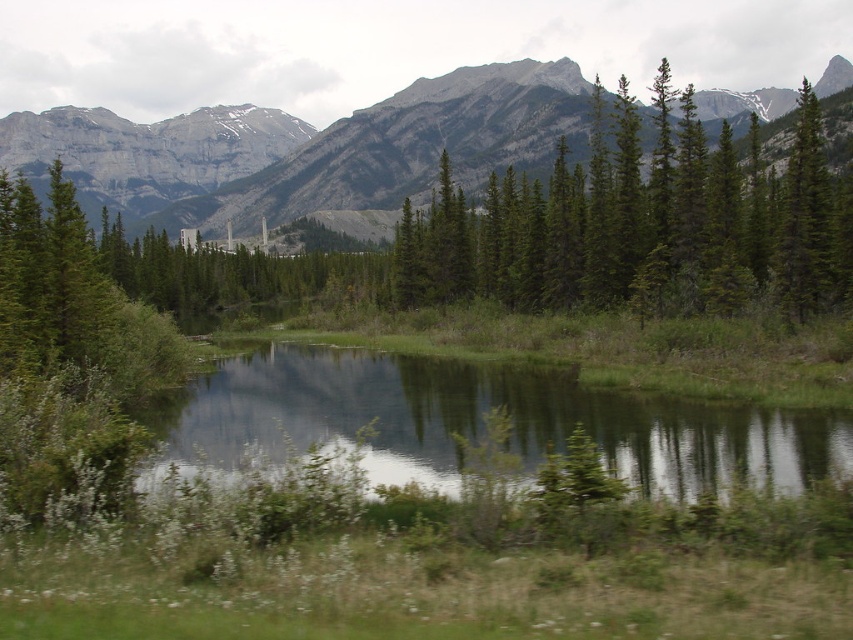
Does green textured trees at upper right appear on the right side of green grassy pond at center?

Yes, green textured trees at upper right is to the right of green grassy pond at center.

The image size is (853, 640). What do you see at coordinates (640, 221) in the screenshot?
I see `green textured trees at upper right` at bounding box center [640, 221].

Between point (844, 202) and point (602, 412), which one is positioned in front?

Positioned in front is point (602, 412).

Locate an element on the screen. The image size is (853, 640). green textured trees at upper right is located at coordinates (640, 221).

Does green textured trees at upper right lie behind gray rock mountain at upper center?

No, green textured trees at upper right is closer to the viewer.

Which of these two, green textured trees at upper right or gray rock mountain at upper center, stands taller?

gray rock mountain at upper center

Image resolution: width=853 pixels, height=640 pixels. In order to click on green textured trees at upper right in this screenshot , I will do `click(640, 221)`.

Who is higher up, green grassy pond at center or gray rock mountain at upper center?

gray rock mountain at upper center is above.

This screenshot has height=640, width=853. Identify the location of green grassy pond at center. (479, 422).

Where is `green grassy pond at center`? green grassy pond at center is located at coordinates (479, 422).

Image resolution: width=853 pixels, height=640 pixels. I want to click on green grassy pond at center, so click(479, 422).